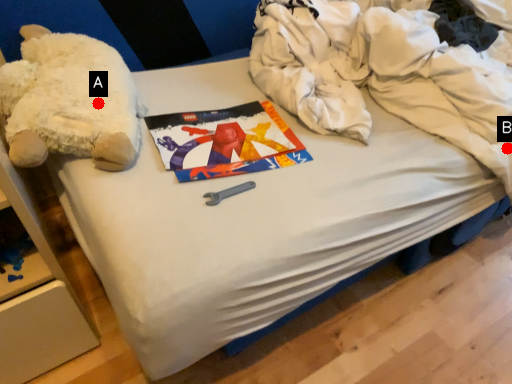
Question: Two points are circled on the image, labeled by A and B beside each circle. Which point is closer to the camera?

Choices:
 (A) A is closer
 (B) B is closer

Answer: (A)